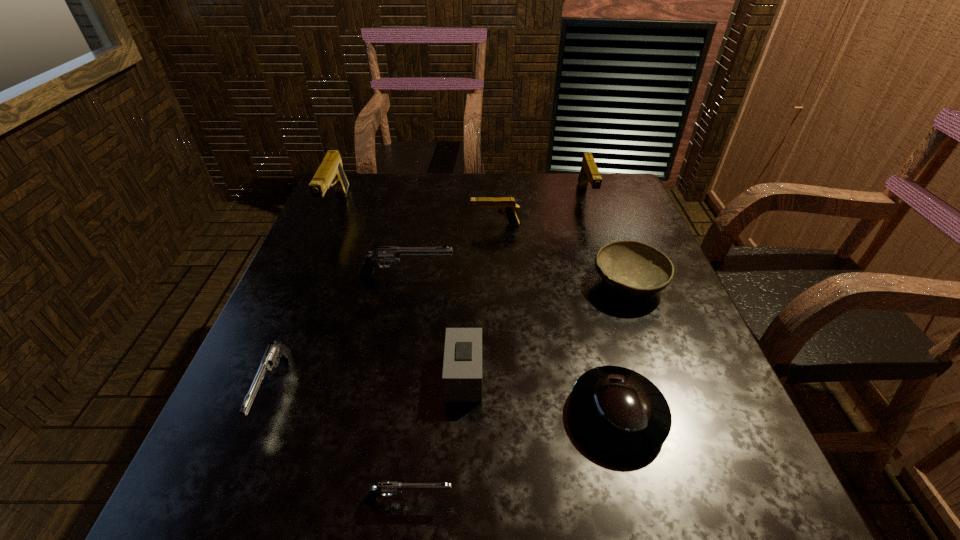
Find the location of a particular element. This screenshot has height=540, width=960. the second nearest silver pistol is located at coordinates (276, 350).

Image resolution: width=960 pixels, height=540 pixels. I want to click on bowl, so click(633, 268).

At what (x,y) coordinates should I click in order to perform the action: click on saucer. Please return your answer as a coordinate pair (x, y). This screenshot has height=540, width=960. Looking at the image, I should click on (622, 411).

The width and height of the screenshot is (960, 540). In order to click on the smallest silver pistol in this screenshot , I will do `click(386, 488)`.

The image size is (960, 540). I want to click on the nearest pistol, so click(386, 488).

Identify the location of free space located 0.240m at the barrel of the leftmost pistol. pyautogui.click(x=300, y=293).

What are the coordinates of `free region located 0.130m at the barrel of the second tallest pistol` in the screenshot? It's located at (601, 242).

Image resolution: width=960 pixels, height=540 pixels. I want to click on vacant space located 0.290m on the front-facing side of the third nearest pistol, so click(576, 276).

Find the location of a particular element. vacant space situated at the barrel of the fifth pistol from left to right is located at coordinates (372, 225).

Where is `free space located at the barrel of the fifth pistol from left to right`? free space located at the barrel of the fifth pistol from left to right is located at coordinates (356, 225).